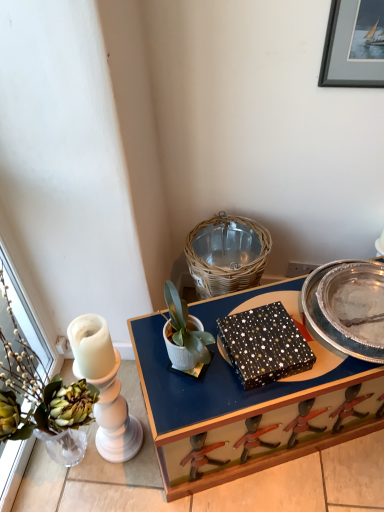
Question: Visually, is white matte pot at center positioned to the left or to the right of silver metallic picture frame at upper right?

Choices:
 (A) left
 (B) right

Answer: (A)

Question: Looking at their shapes, would you say white matte pot at center is wider or thinner than silver metallic picture frame at upper right?

Choices:
 (A) thin
 (B) wide

Answer: (B)

Question: Based on their relative distances, which object is farther from the black textured box at center?

Choices:
 (A) woven wicker basket at upper center
 (B) white matte pot at center
 (C) silver metallic tray at center-right
 (D) matte black box at center
 (E) silver metallic picture frame at upper right

Answer: (E)

Question: Considering the real-world distances, which object is closest to the white matte pot at center?

Choices:
 (A) black textured box at center
 (B) matte black box at center
 (C) woven wicker basket at upper center
 (D) silver metallic tray at center-right
 (E) silver metallic picture frame at upper right

Answer: (A)